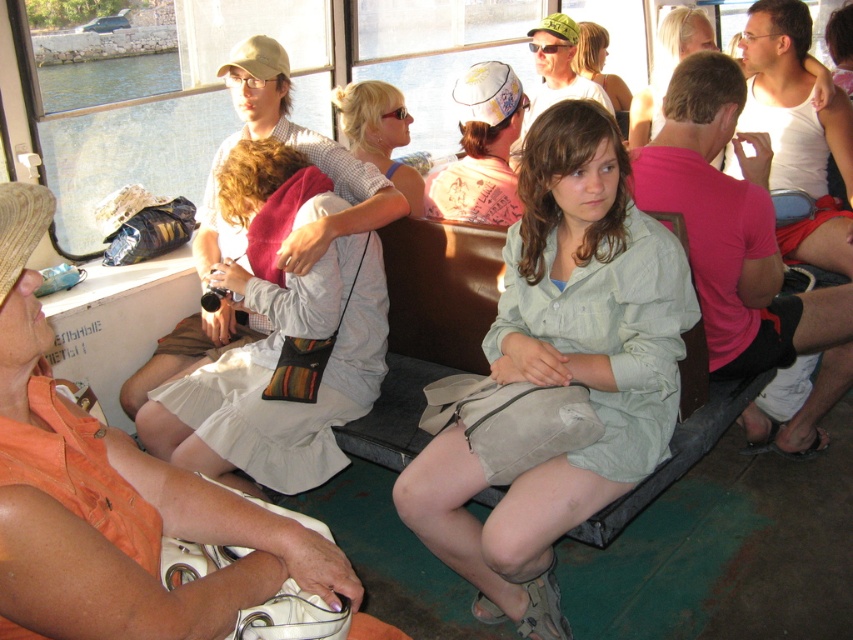
You are a photographer standing at the back of the boat. You want to take a photo of the striped fabric bag at center without moving any objects. Can you capture it clearly from your current position?

The striped fabric bag at center is 7.32 feet away from the camera. Since you are at the back of the boat, you can zoom in or use a telephoto lens to capture it clearly without moving any objects.

You are a photographer standing in the boat and want to take a photo of the striped fabric bag at center and blonde hair at center. The camera you have can only focus on objects within 1.5 meters of each other. Will both subjects be in focus?

The distance between the striped fabric bag at center and blonde hair at center is 1.79 meters, which is greater than the camera focus range of 1.5 meters. Therefore, both subjects cannot be in focus simultaneously.